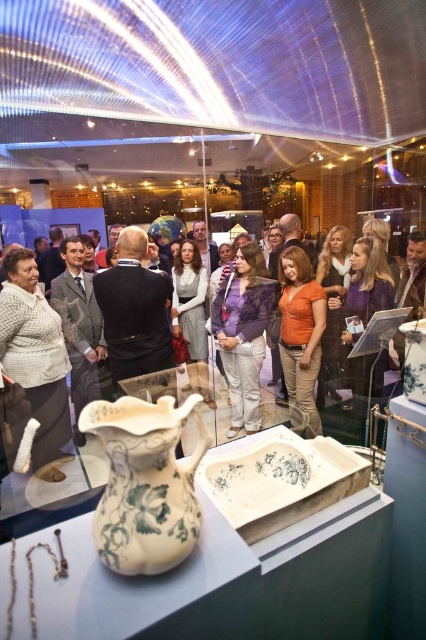
Is purple lace blouse at center positioned at the back of orange cotton shirt at center?

Yes, it is behind orange cotton shirt at center.

From the picture: Is purple lace blouse at center to the left of orange cotton shirt at center from the viewer's perspective?

Indeed, purple lace blouse at center is positioned on the left side of orange cotton shirt at center.

Which is in front, point (218, 339) or point (313, 310)?

Point (313, 310) is more forward.

The image size is (426, 640). What are the coordinates of `purple lace blouse at center` in the screenshot? It's located at (244, 333).

Does matte black jacket at center appear on the right side of purple lace blouse at center?

Yes, matte black jacket at center is to the right of purple lace blouse at center.

Between point (63, 305) and point (238, 352), which one is positioned behind?

The point (238, 352) is more distant.

Identify the location of matte black jacket at center. This screenshot has height=640, width=426. (255, 326).

Does white knitted sweater at left have a larger size compared to purple lace blouse at center?

No, white knitted sweater at left is not bigger than purple lace blouse at center.

Who is taller, white knitted sweater at left or purple lace blouse at center?

white knitted sweater at left is taller.

The height and width of the screenshot is (640, 426). Find the location of `white knitted sweater at left`. white knitted sweater at left is located at coordinates (34, 353).